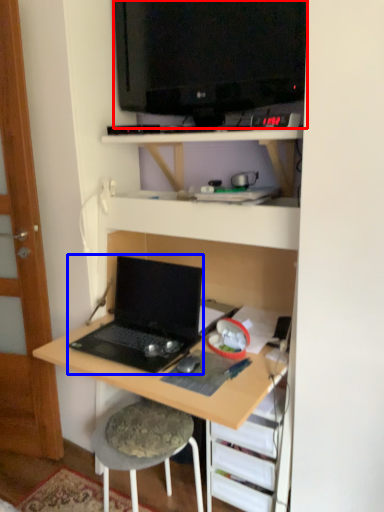
Question: Among these objects, which one is farthest to the camera, television (highlighted by a red box) or laptop (highlighted by a blue box)?

Choices:
 (A) television
 (B) laptop

Answer: (B)